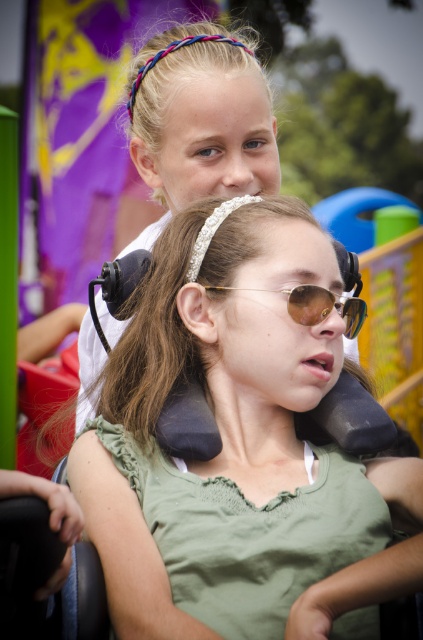
Consider the image. Does green matte shirt at center have a lesser height compared to gold reflective sunglasses at center?

No, green matte shirt at center is not shorter than gold reflective sunglasses at center.

Is green matte shirt at center closer to the viewer compared to gold reflective sunglasses at center?

Yes.

Measure the distance between point (277, 413) and camera.

A distance of 2.59 meters exists between point (277, 413) and camera.

This screenshot has height=640, width=423. In order to click on green matte shirt at center in this screenshot , I will do `click(238, 448)`.